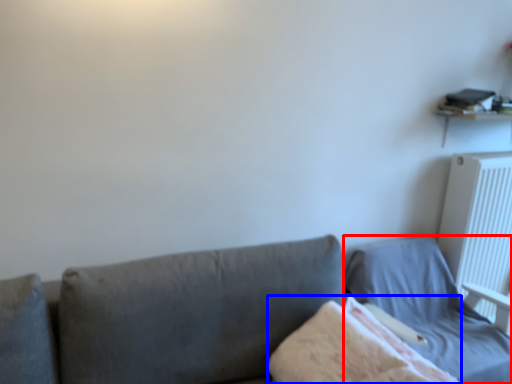
Question: Which point is closer to the camera, bed (highlighted by a red box) or blanket (highlighted by a blue box)?

Choices:
 (A) bed
 (B) blanket

Answer: (B)